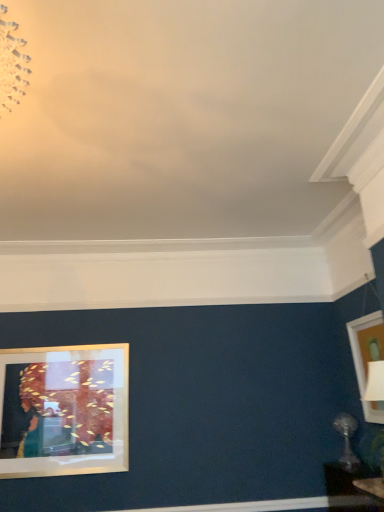
Question: Is matte black table at lower right smaller than satin silver table lamp at lower right?

Choices:
 (A) no
 (B) yes

Answer: (A)

Question: Considering the relative positions of matte black table at lower right and satin silver table lamp at lower right in the image provided, is matte black table at lower right to the right of satin silver table lamp at lower right from the viewer's perspective?

Choices:
 (A) yes
 (B) no

Answer: (B)

Question: Considering the relative positions of matte black table at lower right and satin silver table lamp at lower right in the image provided, is matte black table at lower right to the left of satin silver table lamp at lower right from the viewer's perspective?

Choices:
 (A) no
 (B) yes

Answer: (B)

Question: From a real-world perspective, is matte black table at lower right physically below satin silver table lamp at lower right?

Choices:
 (A) yes
 (B) no

Answer: (A)

Question: Is matte black table at lower right taller than satin silver table lamp at lower right?

Choices:
 (A) yes
 (B) no

Answer: (A)

Question: From the image's perspective, is matte black table at lower right located beneath satin silver table lamp at lower right?

Choices:
 (A) no
 (B) yes

Answer: (B)

Question: Can you confirm if satin silver table lamp at lower right is bigger than matte black table at lower right?

Choices:
 (A) yes
 (B) no

Answer: (B)

Question: Is satin silver table lamp at lower right shorter than matte black table at lower right?

Choices:
 (A) yes
 (B) no

Answer: (A)

Question: Would you say satin silver table lamp at lower right is a long distance from matte black table at lower right?

Choices:
 (A) no
 (B) yes

Answer: (A)

Question: Is satin silver table lamp at lower right positioned beyond the bounds of matte black table at lower right?

Choices:
 (A) no
 (B) yes

Answer: (B)

Question: Can you confirm if satin silver table lamp at lower right is smaller than matte black table at lower right?

Choices:
 (A) yes
 (B) no

Answer: (A)

Question: Is satin silver table lamp at lower right taller than matte black table at lower right?

Choices:
 (A) no
 (B) yes

Answer: (A)

Question: Can you confirm if satin silver table lamp at lower right is shorter than matte gold picture frame at upper right?

Choices:
 (A) yes
 (B) no

Answer: (A)